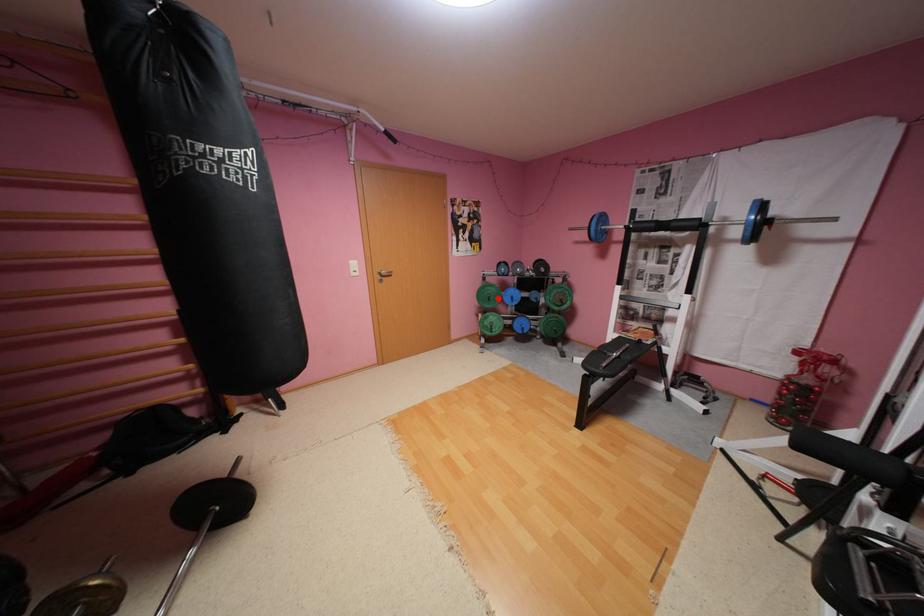
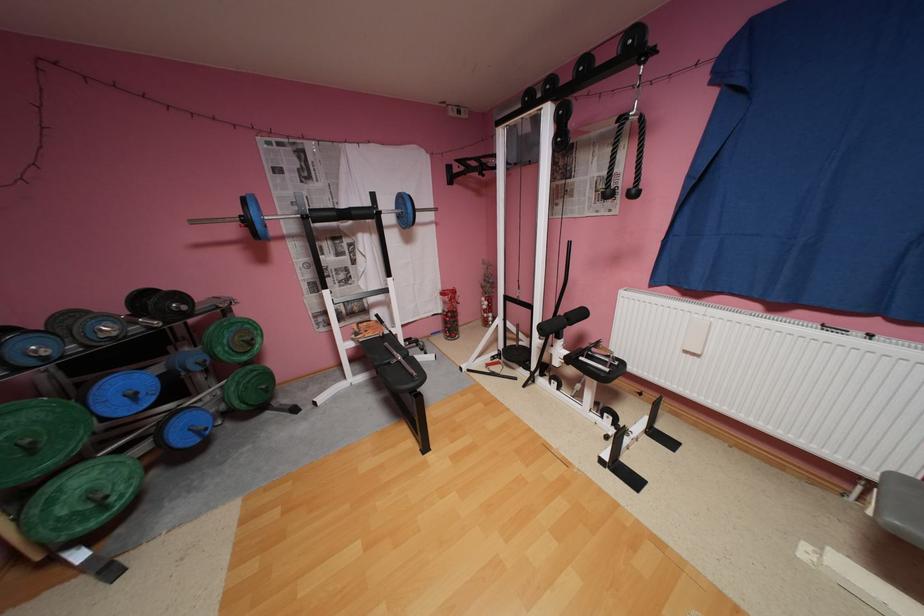
Question: I am providing you with two images of the same scene from different viewpoints. A red point is marked on the first image. Is the red point's position out of view in image 2?

Choices:
 (A) Yes
 (B) No

Answer: (B)